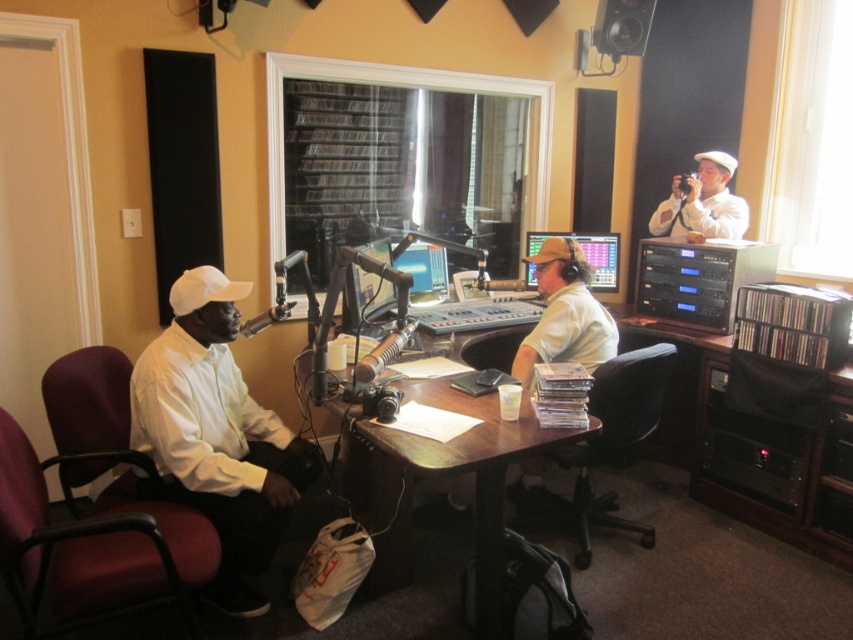
Question: Among these points, which one is nearest to the camera?

Choices:
 (A) (589, 532)
 (B) (524, 429)
 (C) (712, 172)
 (D) (276, 541)

Answer: (B)

Question: Is maroon fabric swivel chair at left below black plastic swivel chair at center?

Choices:
 (A) yes
 (B) no

Answer: (A)

Question: From the image, what is the correct spatial relationship of white matte shirt at left in relation to maroon fabric swivel chair at left?

Choices:
 (A) below
 (B) above

Answer: (B)

Question: Which of these objects is positioned closest to the white matte hat at upper right?

Choices:
 (A) transparent plastic cd rack at right
 (B) maroon fabric swivel chair at left
 (C) wooden desk at center
 (D) white matte shirt at center

Answer: (A)

Question: Which object is farther from the camera taking this photo?

Choices:
 (A) matte black monitor at center
 (B) wooden desk at center
 (C) transparent plastic cd rack at right

Answer: (A)

Question: Can you confirm if maroon fabric swivel chair at left is smaller than wooden desk at center?

Choices:
 (A) yes
 (B) no

Answer: (A)